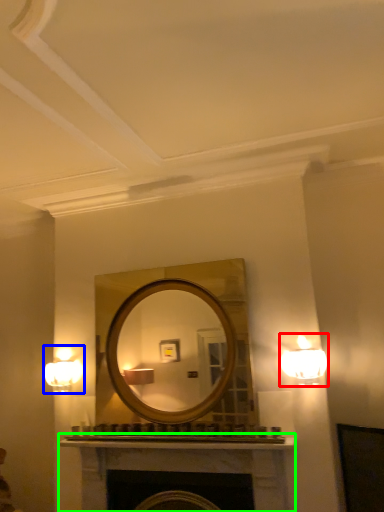
Question: Which object is the closest to the lamp (highlighted by a red box)? Choose among these: fixture (highlighted by a blue box) or fireplace (highlighted by a green box).

Choices:
 (A) fixture
 (B) fireplace

Answer: (B)